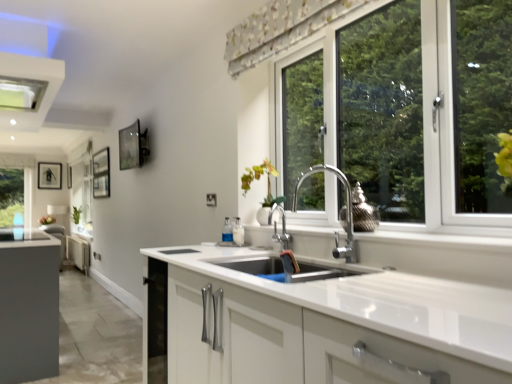
Question: Is the depth of green matte plant at left greater than that of white glossy vase at center?

Choices:
 (A) no
 (B) yes

Answer: (B)

Question: From the image's perspective, is green matte plant at left below white glossy vase at center?

Choices:
 (A) yes
 (B) no

Answer: (A)

Question: Is white glossy vase at center at the back of green matte plant at left?

Choices:
 (A) no
 (B) yes

Answer: (A)

Question: Can you confirm if green matte plant at left is wider than white glossy vase at center?

Choices:
 (A) yes
 (B) no

Answer: (A)

Question: From a real-world perspective, is green matte plant at left over white glossy vase at center?

Choices:
 (A) no
 (B) yes

Answer: (A)

Question: From the image's perspective, is floral fabric curtain at upper center positioned above or below white matte cabinet at center?

Choices:
 (A) above
 (B) below

Answer: (A)

Question: Looking at their shapes, would you say floral fabric curtain at upper center is wider or thinner than white matte cabinet at center?

Choices:
 (A) wide
 (B) thin

Answer: (B)

Question: Is floral fabric curtain at upper center inside the boundaries of white matte cabinet at center, or outside?

Choices:
 (A) inside
 (B) outside

Answer: (B)

Question: In the image, is floral fabric curtain at upper center positioned in front of or behind white matte cabinet at center?

Choices:
 (A) behind
 (B) front

Answer: (B)

Question: Would you say white glossy vase at center is inside or outside white plastic exhaust hood at upper left?

Choices:
 (A) inside
 (B) outside

Answer: (B)

Question: From a real-world perspective, is white glossy vase at center positioned above or below white plastic exhaust hood at upper left?

Choices:
 (A) below
 (B) above

Answer: (A)

Question: From the image's perspective, is white glossy vase at center above or below white plastic exhaust hood at upper left?

Choices:
 (A) above
 (B) below

Answer: (B)

Question: Visually, is white glossy vase at center positioned to the left or to the right of white plastic exhaust hood at upper left?

Choices:
 (A) right
 (B) left

Answer: (A)

Question: Considering the relative positions of metallic glass picture frame at upper left, the 2th picture frame from the left, and white matte cabinet at center in the image provided, is metallic glass picture frame at upper left, the 2th picture frame from the left, to the left or to the right of white matte cabinet at center?

Choices:
 (A) right
 (B) left

Answer: (B)

Question: Is metallic glass picture frame at upper left, placed as the 1th picture frame when sorted from right to left, bigger or smaller than white matte cabinet at center?

Choices:
 (A) small
 (B) big

Answer: (A)